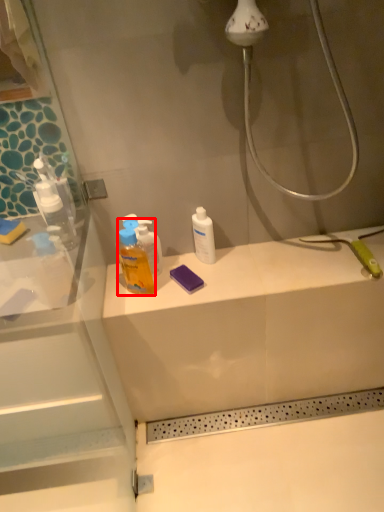
Question: In this image, where is cleaning product (annotated by the red box) located relative to mouthwash?

Choices:
 (A) right
 (B) left

Answer: (B)